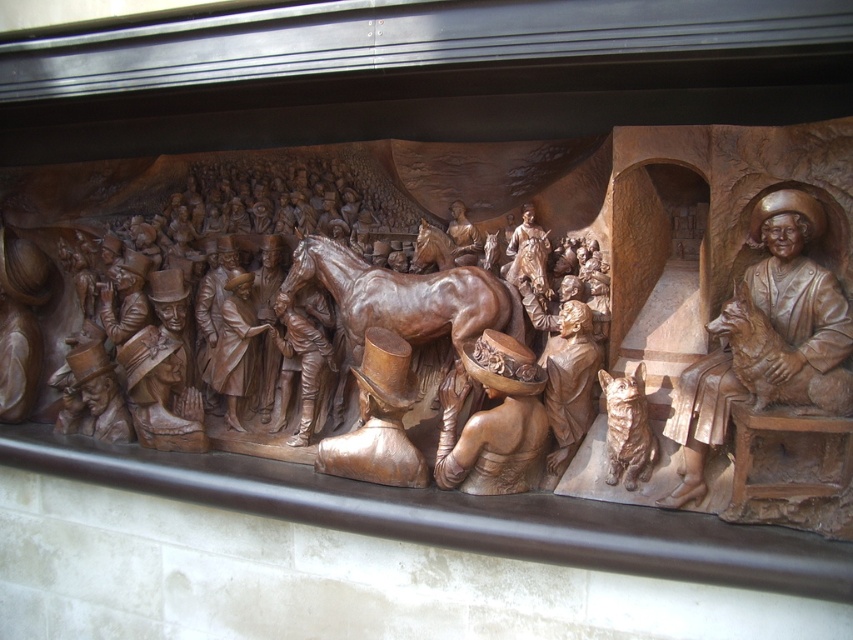
Between wooden hat at center and matte brown boot at center, which one is positioned higher?

matte brown boot at center is higher up.

Consider the image. Who is more forward, (x=486, y=385) or (x=328, y=461)?

Point (x=486, y=385)

Which is in front, point (514, 368) or point (364, 397)?

Point (514, 368) is more forward.

Locate an element on the screen. The width and height of the screenshot is (853, 640). wooden hat at center is located at coordinates (492, 419).

Between point (842, 481) and point (386, 332), which one is positioned behind?

The point (386, 332) is behind.

Measure the distance from bronze statue of man with dog at right to matte brown boot at center.

bronze statue of man with dog at right and matte brown boot at center are 4.68 feet apart from each other.

What are the coordinates of `bronze statue of man with dog at right` in the screenshot? It's located at (766, 340).

Identify the location of bronze statue of man with dog at right. The image size is (853, 640). (766, 340).

Which is more to the left, polished brown horse at center or matte brown boot at center?

Positioned to the left is matte brown boot at center.

Is point (354, 284) positioned behind point (408, 344)?

Yes, it is behind point (408, 344).

Does point (457, 296) come closer to viewer compared to point (386, 340)?

Yes, point (457, 296) is in front of point (386, 340).

Identify the location of polished brown horse at center. (402, 298).